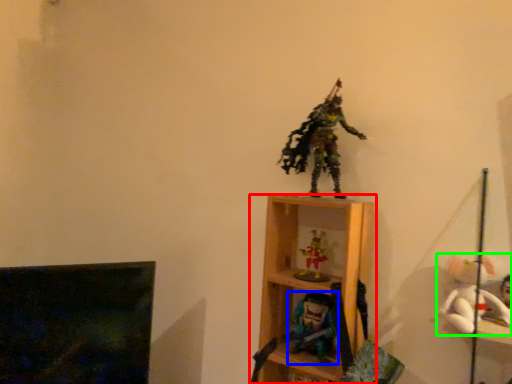
Question: Which object is positioned closest to shelf (highlighted by a red box)? Select from toy (highlighted by a blue box) and toy (highlighted by a green box).

Choices:
 (A) toy
 (B) toy

Answer: (A)